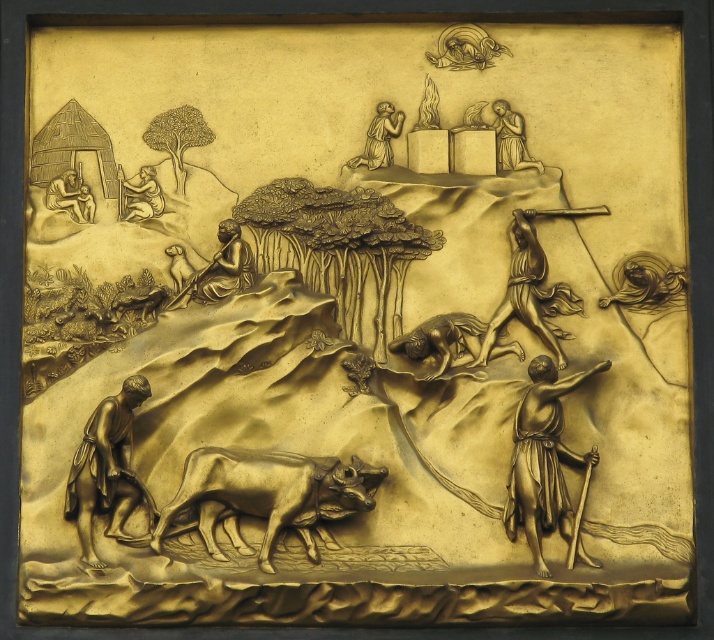
Question: Is gold textured oxen at center to the right of bronze farmer at lower left from the viewer's perspective?

Choices:
 (A) yes
 (B) no

Answer: (A)

Question: Estimate the real-world distances between objects in this image. Which object is closer to the gold textured cow at center?

Choices:
 (A) polished bronze shepherd at right
 (B) gold textured figure at center

Answer: (A)

Question: Observing the image, what is the correct spatial positioning of bronze statue of person at upper center in reference to gold textured figure at upper left?

Choices:
 (A) right
 (B) left

Answer: (A)

Question: Is bronze statue of person at upper center wider than matte gold figure at upper left?

Choices:
 (A) no
 (B) yes

Answer: (A)

Question: Which object is farther from the camera taking this photo?

Choices:
 (A) bronze statue of person at upper center
 (B) gold relief figure at upper right

Answer: (A)

Question: Which object is positioned farthest from the matte gold figure at upper left?

Choices:
 (A) gold textured figure at center
 (B) polished bronze shepherd at right

Answer: (B)